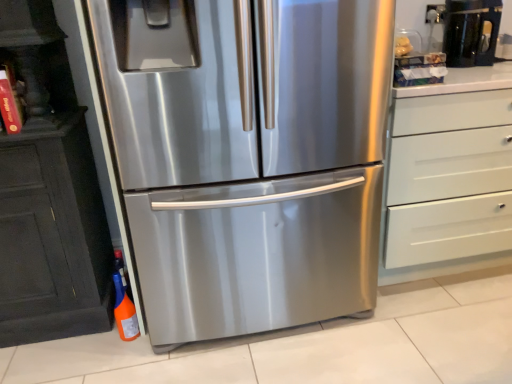
You are a GUI agent. You are given a task and a screenshot of the screen. Output one action in this format:
    pyautogui.click(x=<x>, y=<y>)
    Task: Click on the vacant space in front of orange matte bottle at lower left
    
    Given the screenshot: What is the action you would take?
    pyautogui.click(x=119, y=357)